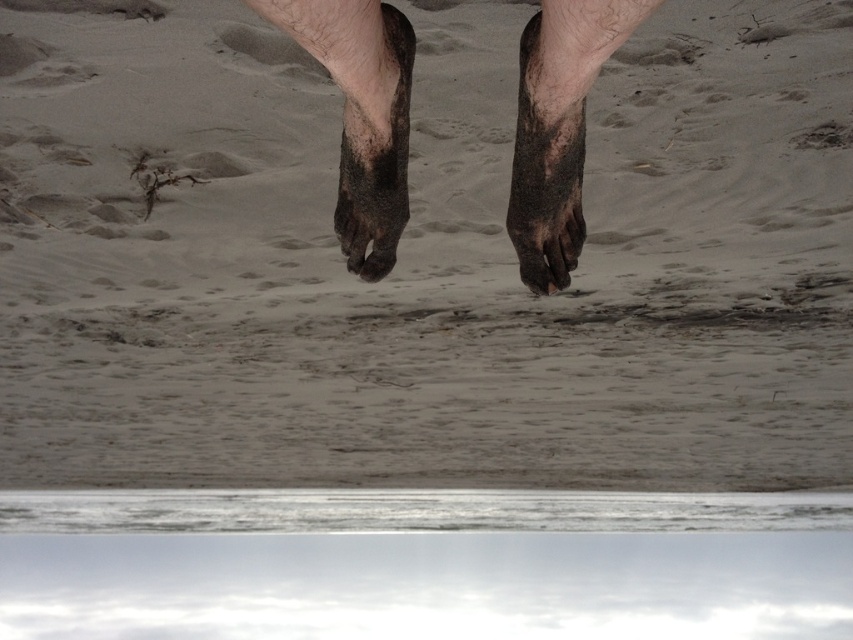
Is dull black feet at center to the right of dull brown skin at center from the viewer's perspective?

Yes, dull black feet at center is to the right of dull brown skin at center.

Is dull black feet at center closer to the viewer compared to dull brown skin at center?

That is True.

Which is in front, point (561, 93) or point (358, 208)?

Point (561, 93) is in front.

Locate an element on the screen. dull black feet at center is located at coordinates (558, 129).

Who is lower down, dusty brown foot at center or dirty sand foot at center?

dusty brown foot at center is lower down.

Between dusty brown foot at center and dirty sand foot at center, which one appears on the left side from the viewer's perspective?

From the viewer's perspective, dusty brown foot at center appears more on the left side.

Who is more distant from viewer, (369,92) or (579,234)?

Point (579,234)

Where is `dusty brown foot at center`? This screenshot has height=640, width=853. dusty brown foot at center is located at coordinates (375, 156).

Which is more to the left, dull brown skin at center or dirty sand foot at center?

dull brown skin at center

Identify the location of dull brown skin at center. The width and height of the screenshot is (853, 640). (361, 115).

The width and height of the screenshot is (853, 640). Describe the element at coordinates (361, 115) in the screenshot. I see `dull brown skin at center` at that location.

Where is `dull brown skin at center`? The height and width of the screenshot is (640, 853). dull brown skin at center is located at coordinates (361, 115).